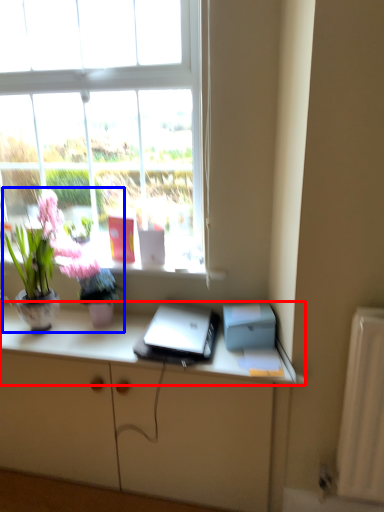
Question: Which of the following is the farthest to the observer, desk (highlighted by a red box) or houseplant (highlighted by a blue box)?

Choices:
 (A) desk
 (B) houseplant

Answer: (B)